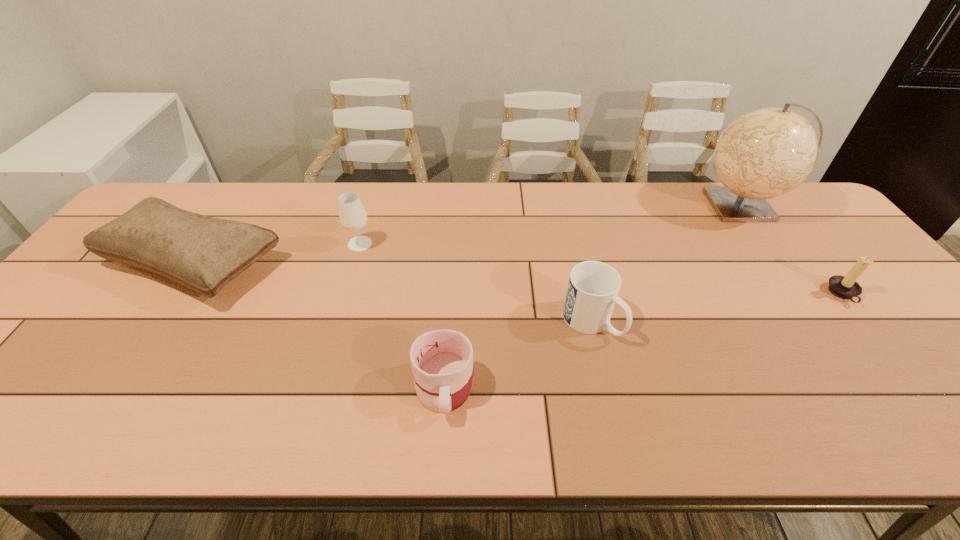
This screenshot has width=960, height=540. Find the location of `globe`. globe is located at coordinates (768, 152).

Where is `the second object from left to right`? The width and height of the screenshot is (960, 540). the second object from left to right is located at coordinates (353, 217).

The height and width of the screenshot is (540, 960). What are the coordinates of `cushion` in the screenshot? It's located at (203, 253).

You are a GUI agent. You are given a task and a screenshot of the screen. Output one action in this format:
    pyautogui.click(x=<x>, y=<y>)
    Task: Click on the third object from right to left
    
    Given the screenshot: What is the action you would take?
    pyautogui.click(x=593, y=287)

This screenshot has width=960, height=540. What are the coordinates of `the farther mug` in the screenshot? It's located at (593, 287).

I want to click on candle holder, so click(845, 287).

Identify the location of the shortest object. (442, 360).

This screenshot has width=960, height=540. I want to click on the left mug, so click(x=442, y=360).

You are a GUI agent. You are given a task and a screenshot of the screen. Output one action in this format:
    pyautogui.click(x=<x>, y=<y>)
    Task: Click on the free space located on the surface of the globe showing Europe and Africa
    
    Given the screenshot: What is the action you would take?
    pyautogui.click(x=638, y=206)

I want to click on vacant area located on the surface of the globe showing Europe and Africa, so 636,206.